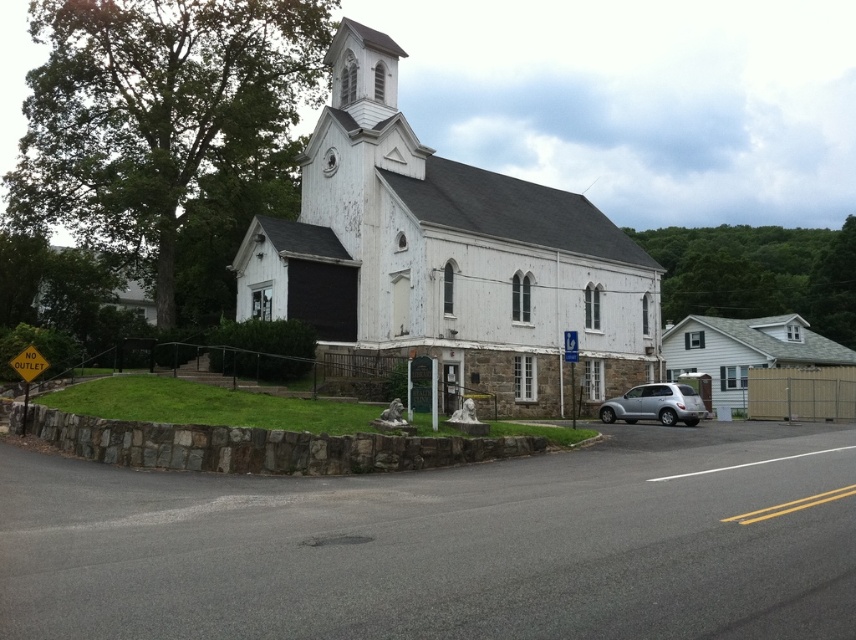
Question: Can you confirm if white wooden church at center is positioned to the right of silver metallic suv at lower right?

Choices:
 (A) yes
 (B) no

Answer: (B)

Question: Is white wooden church at center thinner than silver metallic suv at lower right?

Choices:
 (A) no
 (B) yes

Answer: (A)

Question: Which object is closer to the camera taking this photo?

Choices:
 (A) white wooden church at center
 (B) silver metallic suv at lower right

Answer: (A)

Question: Does white wooden church at center appear on the right side of silver metallic suv at lower right?

Choices:
 (A) yes
 (B) no

Answer: (B)